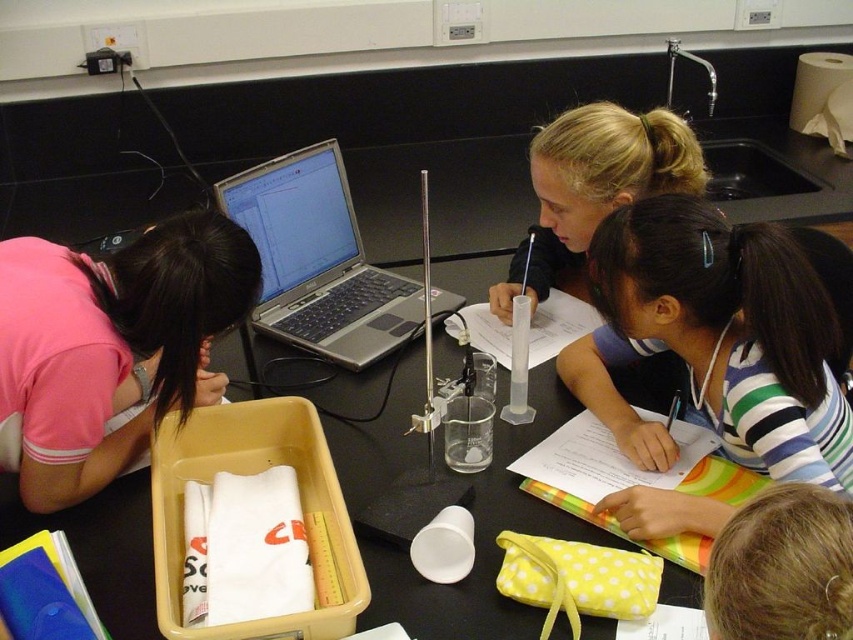
Where is the striped fabric shirt at center located in the image?

The striped fabric shirt at center is located at point (717, 339) in the image.

You are a student in the classroom and need to choose a fabric sample for a science experiment. The striped fabric shirt at center and the pink fabric at left are available. Which fabric sample has a larger size?

The striped fabric shirt at center is bigger than the pink fabric at left, so the striped fabric shirt at center has a larger size.

You are a student in the classroom looking at the laptop. You notice the pink fabric at left and the blonde hair at upper center. Which object is closer to you?

The pink fabric at left is closer to you because it is further to the viewer than the blonde hair at upper center.